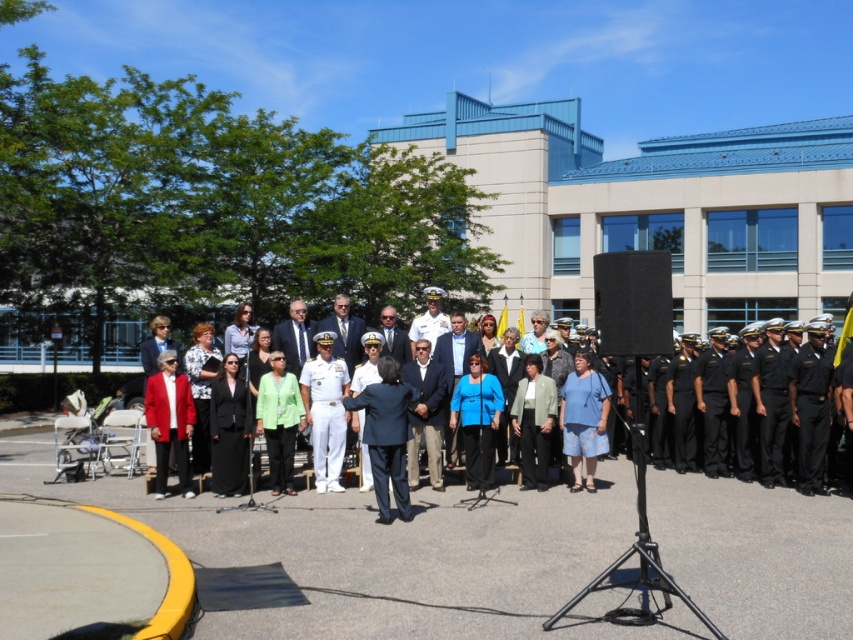
In the scene shown: You are a photographer at the event and need to capture a photo where both the dark blue suit at center and the matte red blazer at left are visible. Given their heights, which one might appear closer to the camera in the photo?

The dark blue suit at center is shorter than the matte red blazer at left, so in the photo, the dark blue suit at center would appear closer to the camera since it is shorter.

You are organizing a photo shoot and need to place two models wearing the dark blue suit at center and the green matte jacket at center side by side. Based on their sizes, which model should stand on the left to avoid overlapping?

The dark blue suit at center is wider than the green matte jacket at center, so placing the model in the dark blue suit at center on the left would prevent overlapping as it takes up more space.

You are organizing a photo shoot and need to place a camera stand between the matte black suit at center and the matte red blazer at left. Given that the camera stand requires a minimum of 1.2 meters of space to operate, can you determine if there is enough space between them based on their widths?

The matte black suit at center is wider than the matte red blazer at left. However, the exact distance between them isn t provided in the description. The question asks about space between them, but the objects description only compares their widths, not the distance separating them. Therefore, it isn t possible to determine if there s sufficient space for the camera stand based on the given information.